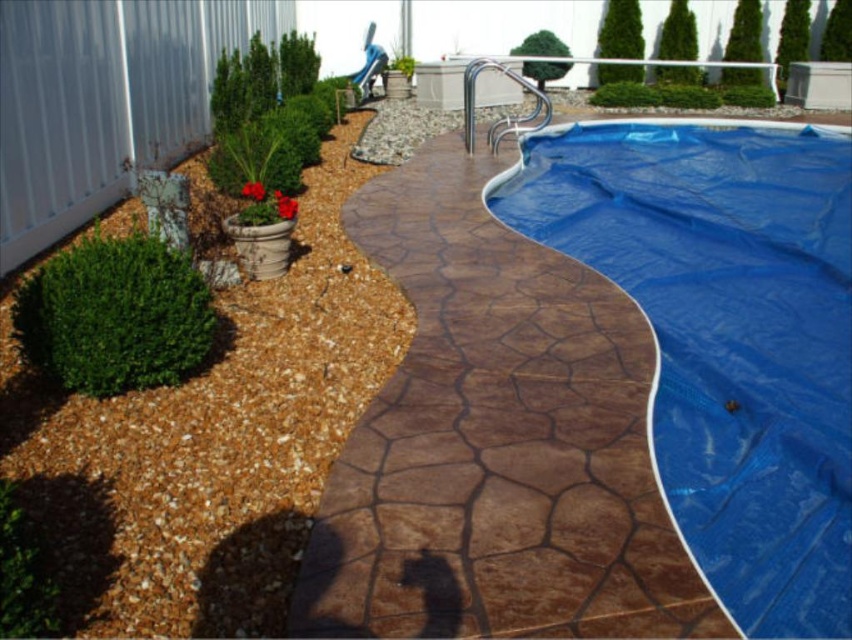
Question: Which object appears farthest from the camera in this image?

Choices:
 (A) brown gravel mulch at lower left
 (B) blue tarp at center
 (C) brown textured concrete at center

Answer: (A)

Question: Can you confirm if brown textured concrete at center is positioned above brown gravel mulch at lower left?

Choices:
 (A) no
 (B) yes

Answer: (B)

Question: In this image, where is brown textured concrete at center located relative to blue tarp at center?

Choices:
 (A) right
 (B) left

Answer: (B)

Question: Which of the following is the farthest from the observer?

Choices:
 (A) blue tarp at center
 (B) brown textured concrete at center

Answer: (A)

Question: Is blue tarp at center positioned in front of brown gravel mulch at lower left?

Choices:
 (A) yes
 (B) no

Answer: (A)

Question: Estimate the real-world distances between objects in this image. Which object is farther from the brown gravel mulch at lower left?

Choices:
 (A) brown textured concrete at center
 (B) blue tarp at center

Answer: (B)